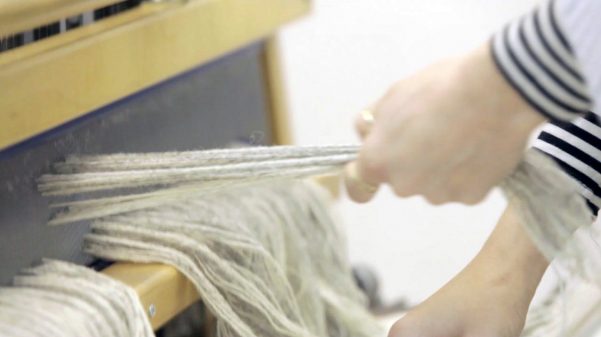
Identify the location of white wall. This screenshot has width=601, height=337. pos(349,37).